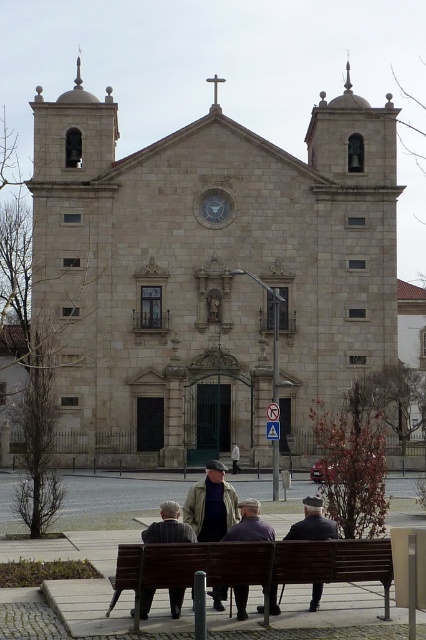
Question: Based on their relative distances, which object is farther from the brown wooden bench at lower center?

Choices:
 (A) khaki fabric jacket at center
 (B) striped fabric jacket at lower center
 (C) beige stone church at center

Answer: (C)

Question: Which point is closer to the camera?

Choices:
 (A) (219, 592)
 (B) (158, 352)

Answer: (A)

Question: Is the position of brown wooden bench at lower center less distant than that of striped fabric jacket at lower center?

Choices:
 (A) no
 (B) yes

Answer: (B)

Question: Which of the following is the closest to the observer?

Choices:
 (A) (270, 593)
 (B) (305, 572)
 (C) (149, 438)
 (D) (311, 598)

Answer: (B)

Question: Is dark brown wood bench at lower center to the right of striped fabric jacket at lower center from the viewer's perspective?

Choices:
 (A) yes
 (B) no

Answer: (A)

Question: Is brown wooden bench at lower center positioned at the back of dark brown leather jacket at lower center?

Choices:
 (A) yes
 (B) no

Answer: (B)